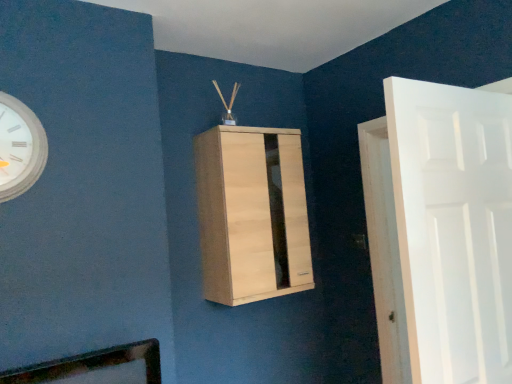
Question: Can you confirm if white matte clock at upper left is taller than light wood cabinet at center?

Choices:
 (A) no
 (B) yes

Answer: (A)

Question: Is white matte clock at upper left looking in the opposite direction of light wood cabinet at center?

Choices:
 (A) no
 (B) yes

Answer: (A)

Question: Can you confirm if white matte clock at upper left is positioned to the right of light wood cabinet at center?

Choices:
 (A) yes
 (B) no

Answer: (B)

Question: Can you confirm if white matte clock at upper left is smaller than light wood cabinet at center?

Choices:
 (A) yes
 (B) no

Answer: (A)

Question: Could you tell me if white matte clock at upper left is facing light wood cabinet at center?

Choices:
 (A) yes
 (B) no

Answer: (B)

Question: Is light wood cabinet at center a part of white matte clock at upper left?

Choices:
 (A) no
 (B) yes

Answer: (A)

Question: From a real-world perspective, does white matte clock at upper left sit lower than white matte door at right?

Choices:
 (A) yes
 (B) no

Answer: (B)

Question: Can you confirm if white matte clock at upper left is shorter than white matte door at right?

Choices:
 (A) yes
 (B) no

Answer: (A)

Question: Considering the relative sizes of white matte clock at upper left and white matte door at right in the image provided, is white matte clock at upper left wider than white matte door at right?

Choices:
 (A) yes
 (B) no

Answer: (B)

Question: Is white matte door at right at the back of white matte clock at upper left?

Choices:
 (A) yes
 (B) no

Answer: (B)

Question: From the image's perspective, does white matte clock at upper left appear higher than white matte door at right?

Choices:
 (A) yes
 (B) no

Answer: (A)

Question: From a real-world perspective, does white matte clock at upper left stand above white matte door at right?

Choices:
 (A) no
 (B) yes

Answer: (B)

Question: From a real-world perspective, is light wood cabinet at center positioned under white matte door at right based on gravity?

Choices:
 (A) no
 (B) yes

Answer: (A)